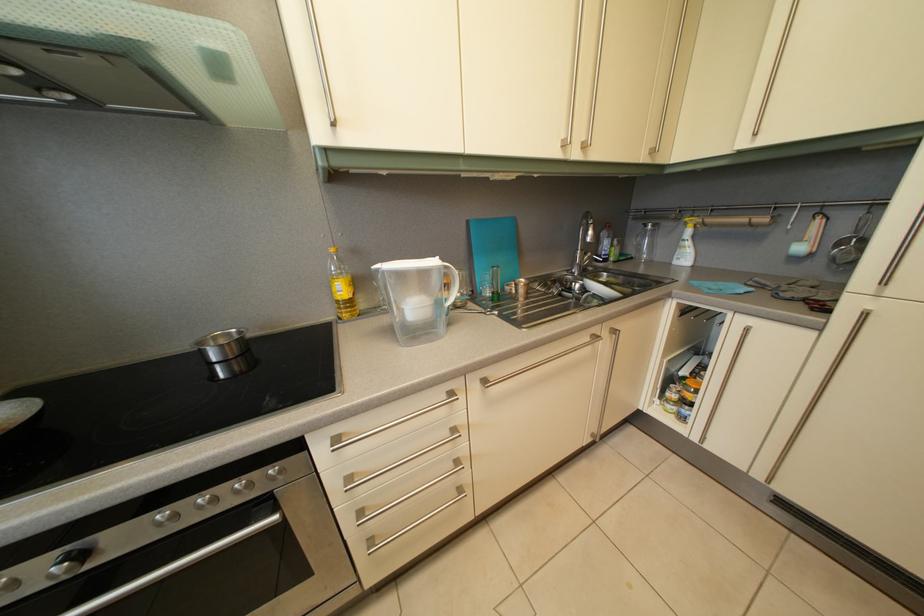
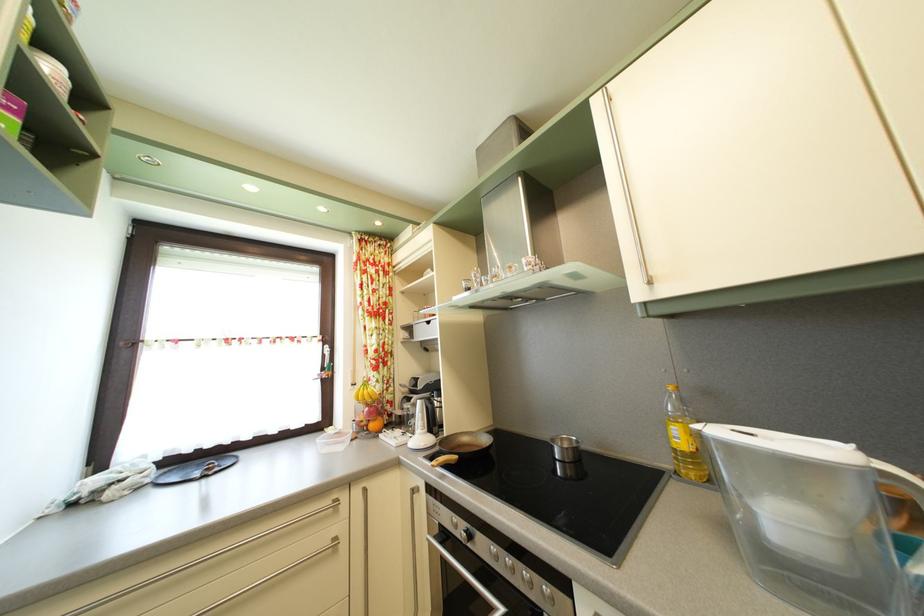
In the second image, find the point that corresponds to the point at 184,524 in the first image.

(505, 565)